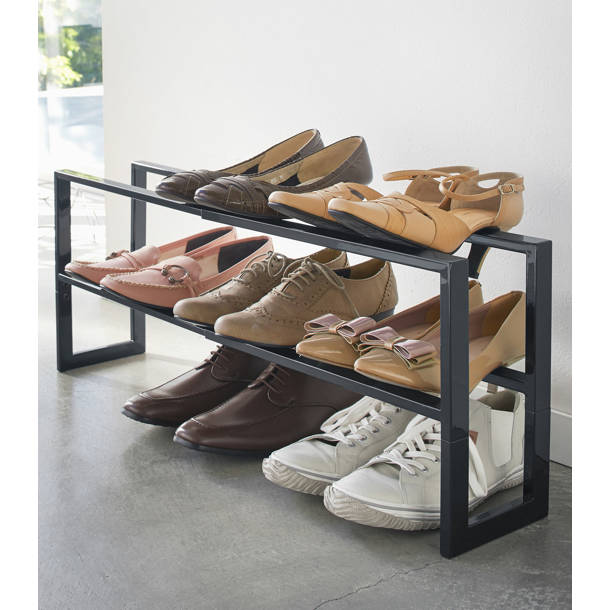
At what (x,y) coordinates should I click in order to perform the action: click on shoes under shoe rack. Please return your answer as a coordinate pair (x, y). This screenshot has height=610, width=610. Looking at the image, I should click on (187, 395), (251, 420), (310, 457), (364, 495).